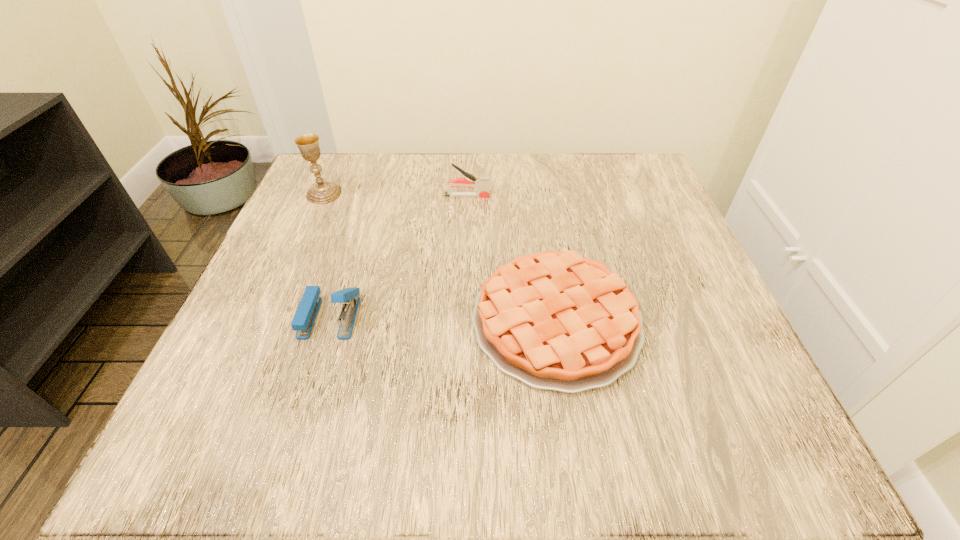
In the image, there is a desktop. Find the location of `vacant space at the far left corner`. vacant space at the far left corner is located at coordinates (357, 154).

I want to click on vacant space at the near left corner of the desktop, so click(x=228, y=417).

Where is `vacant space at the far right corner of the desktop`? vacant space at the far right corner of the desktop is located at coordinates (605, 154).

Locate an element on the screen. The width and height of the screenshot is (960, 540). empty location between the chalice and the second object from left to right is located at coordinates (327, 255).

Locate an element on the screen. The height and width of the screenshot is (540, 960). free space between the nearer stapler and the pie is located at coordinates (443, 319).

Identify the location of free space between the left stapler and the farther stapler. This screenshot has width=960, height=540. (398, 256).

Locate an element on the screen. This screenshot has width=960, height=540. vacant area that lies between the pie and the right stapler is located at coordinates click(512, 259).

Locate an element on the screen. The height and width of the screenshot is (540, 960). free area in between the shortest object and the left stapler is located at coordinates (443, 319).

Locate an element on the screen. The image size is (960, 540). free space between the farther stapler and the tallest object is located at coordinates (396, 195).

Where is `free spot between the right stapler and the third object from right to left`? The width and height of the screenshot is (960, 540). free spot between the right stapler and the third object from right to left is located at coordinates (398, 256).